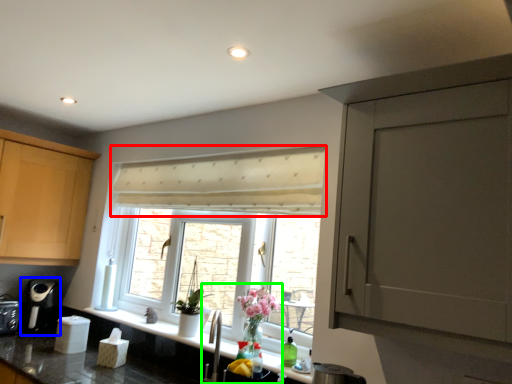
Question: Estimate the real-world distances between objects in this image. Which object is closer to curtain (highlighted by a red box), coffee machine (highlighted by a blue box) or sink (highlighted by a green box)?

Choices:
 (A) coffee machine
 (B) sink

Answer: (B)